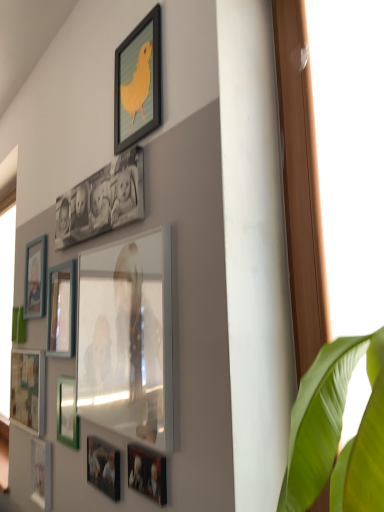
Question: Considering the relative positions of matte wooden picture frame at left, which appears as the third picture frame when viewed from the top, and wooden photo frame at left, positioned as the fourth picture frame in top-to-bottom order, in the image provided, is matte wooden picture frame at left, which appears as the third picture frame when viewed from the top, to the left of wooden photo frame at left, positioned as the fourth picture frame in top-to-bottom order, from the viewer's perspective?

Choices:
 (A) no
 (B) yes

Answer: (B)

Question: Is the position of matte wooden picture frame at left, which is the ninth picture frame from bottom to top, less distant than that of wooden photo frame at left, the eighth picture frame positioned from the bottom?

Choices:
 (A) no
 (B) yes

Answer: (A)

Question: Is matte wooden picture frame at left, which is the ninth picture frame from bottom to top, bigger than wooden photo frame at left, positioned as the fourth picture frame in top-to-bottom order?

Choices:
 (A) yes
 (B) no

Answer: (B)

Question: Is matte wooden picture frame at left, which appears as the third picture frame when viewed from the top, to the right of wooden photo frame at left, the eighth picture frame positioned from the bottom, from the viewer's perspective?

Choices:
 (A) yes
 (B) no

Answer: (B)

Question: Is wooden photo frame at left, the eighth picture frame positioned from the bottom, inside matte wooden picture frame at left, which appears as the third picture frame when viewed from the top?

Choices:
 (A) no
 (B) yes

Answer: (A)

Question: Is the surface of matte wooden picture frame at left, which is the ninth picture frame from bottom to top, in direct contact with wooden photo frame at left, the eighth picture frame positioned from the bottom?

Choices:
 (A) no
 (B) yes

Answer: (A)

Question: Are wooden photo frame at left, the eighth picture frame positioned from the bottom, and matte black photo frame at upper center, which is the tenth picture frame from bottom to top, beside each other?

Choices:
 (A) no
 (B) yes

Answer: (A)

Question: Considering the relative sizes of wooden photo frame at left, the eighth picture frame positioned from the bottom, and matte black photo frame at upper center, the second picture frame viewed from the top, in the image provided, is wooden photo frame at left, the eighth picture frame positioned from the bottom, bigger than matte black photo frame at upper center, the second picture frame viewed from the top,?

Choices:
 (A) no
 (B) yes

Answer: (A)

Question: Is wooden photo frame at left, positioned as the fourth picture frame in top-to-bottom order, taller than matte black photo frame at upper center, which is the tenth picture frame from bottom to top?

Choices:
 (A) yes
 (B) no

Answer: (A)

Question: From a real-world perspective, does wooden photo frame at left, the eighth picture frame positioned from the bottom, stand above matte black photo frame at upper center, which is the tenth picture frame from bottom to top?

Choices:
 (A) no
 (B) yes

Answer: (A)

Question: Can matte black photo frame at upper center, which is the tenth picture frame from bottom to top, be found inside wooden photo frame at left, the eighth picture frame positioned from the bottom?

Choices:
 (A) yes
 (B) no

Answer: (B)

Question: From the image's perspective, is wooden photo frame at left, positioned as the fourth picture frame in top-to-bottom order, on top of matte black photo frame at upper center, which is the tenth picture frame from bottom to top?

Choices:
 (A) yes
 (B) no

Answer: (B)

Question: Would you consider wooden photo frame at left, positioned as the fourth picture frame in top-to-bottom order, to be distant from matte black picture frame at upper center, the first picture frame viewed from the top?

Choices:
 (A) yes
 (B) no

Answer: (B)